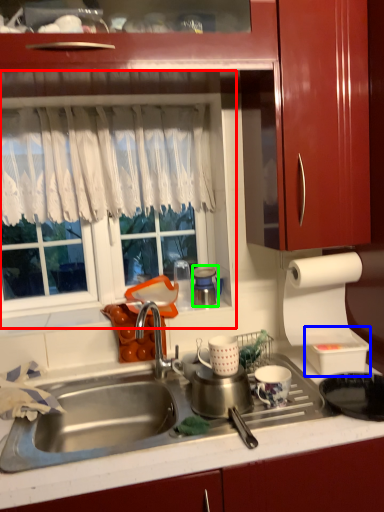
Question: Which object is positioned closest to window screen (highlighted by a red box)? Select from appliance (highlighted by a blue box) and appliance (highlighted by a green box).

Choices:
 (A) appliance
 (B) appliance

Answer: (B)